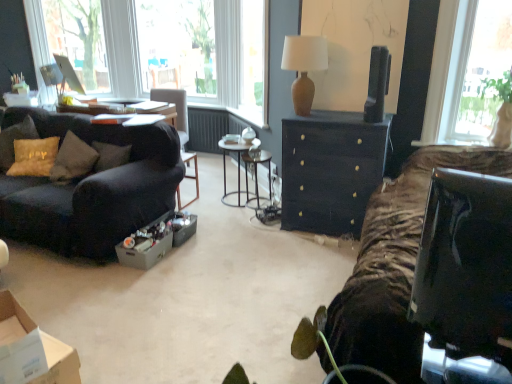
Question: From a real-world perspective, does matte brown vase at upper center stand above velvet dark brown couch at left?

Choices:
 (A) yes
 (B) no

Answer: (A)

Question: From the image's perspective, is matte brown vase at upper center over velvet dark brown couch at left?

Choices:
 (A) no
 (B) yes

Answer: (B)

Question: Can you confirm if matte brown vase at upper center is thinner than velvet dark brown couch at left?

Choices:
 (A) yes
 (B) no

Answer: (A)

Question: Considering the relative sizes of matte brown vase at upper center and velvet dark brown couch at left in the image provided, is matte brown vase at upper center shorter than velvet dark brown couch at left?

Choices:
 (A) yes
 (B) no

Answer: (A)

Question: Is matte brown vase at upper center further to camera compared to velvet dark brown couch at left?

Choices:
 (A) no
 (B) yes

Answer: (B)

Question: Can you confirm if matte brown vase at upper center is positioned to the right of velvet dark brown couch at left?

Choices:
 (A) yes
 (B) no

Answer: (A)

Question: Is black glossy television at upper right directly adjacent to metallic silver side table at center?

Choices:
 (A) yes
 (B) no

Answer: (B)

Question: Would you say black glossy television at upper right is outside metallic silver side table at center?

Choices:
 (A) yes
 (B) no

Answer: (A)

Question: Is black glossy television at upper right further to the viewer compared to metallic silver side table at center?

Choices:
 (A) no
 (B) yes

Answer: (A)

Question: Does black glossy television at upper right have a lesser width compared to metallic silver side table at center?

Choices:
 (A) yes
 (B) no

Answer: (A)

Question: Can you confirm if black glossy television at upper right is positioned to the left of metallic silver side table at center?

Choices:
 (A) yes
 (B) no

Answer: (B)

Question: Is black glossy television at upper right facing away from metallic silver side table at center?

Choices:
 (A) yes
 (B) no

Answer: (B)

Question: Would you say black glossy television at upper right is a long distance from zebra-patterned fabric at right?

Choices:
 (A) no
 (B) yes

Answer: (A)